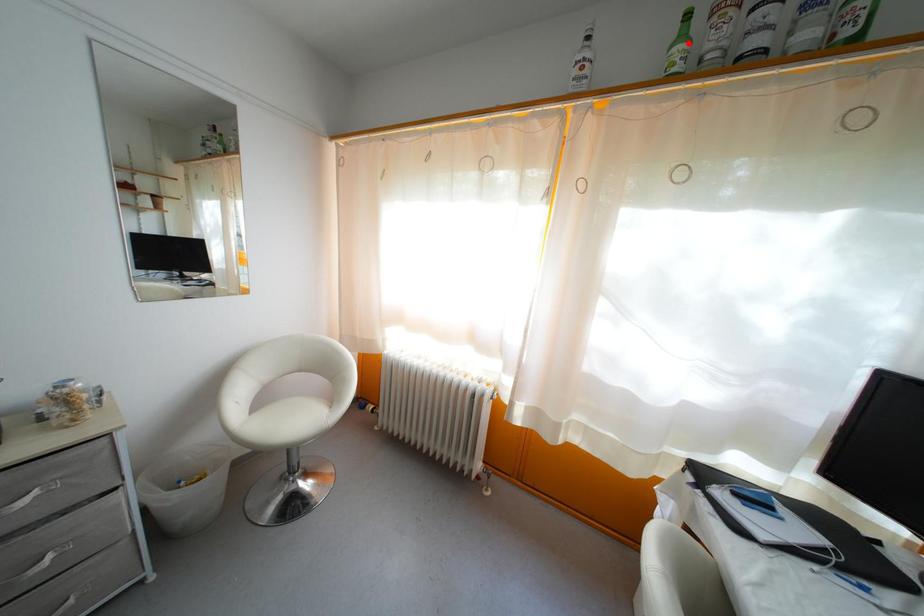
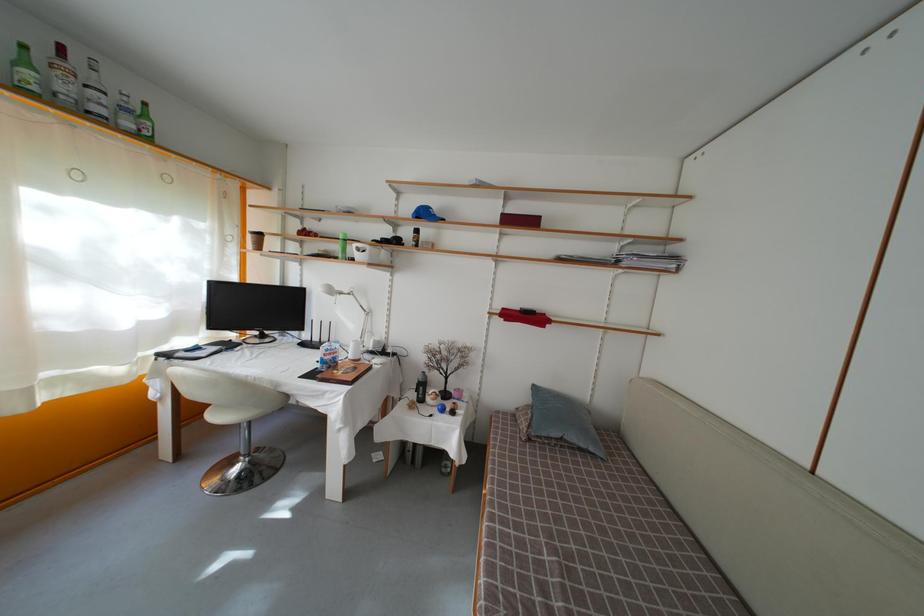
The point at the highlighted location is marked in the first image. Where is the corresponding point in the second image?

(31, 69)